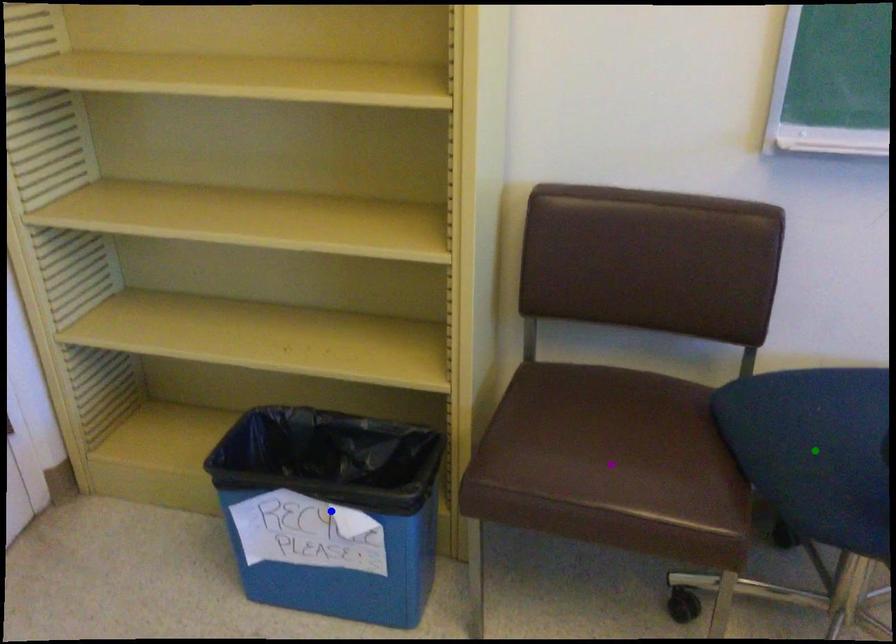
Consider the image. Order these from nearest to farthest:
1. green point
2. blue point
3. purple point

1. green point
2. purple point
3. blue point